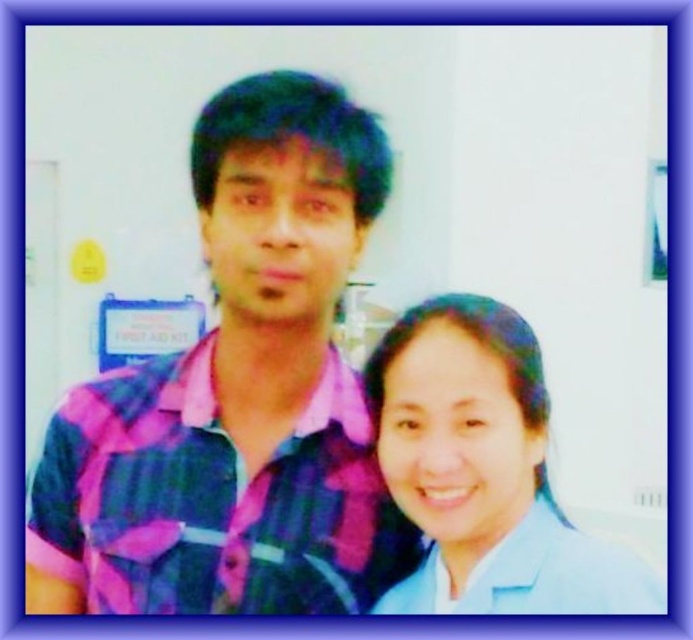
Is pink plaid shirt at center shorter than blue fabric shirt at lower right?

Yes.

Between pink plaid shirt at center and blue fabric shirt at lower right, which one appears on the right side from the viewer's perspective?

From the viewer's perspective, blue fabric shirt at lower right appears more on the right side.

Is point (128, 483) more distant than point (606, 566)?

Yes, point (128, 483) is farther from viewer.

At what (x,y) coordinates should I click in order to perform the action: click on pink plaid shirt at center. Please return your answer as a coordinate pair (x, y). The image size is (693, 640). Looking at the image, I should click on (213, 499).